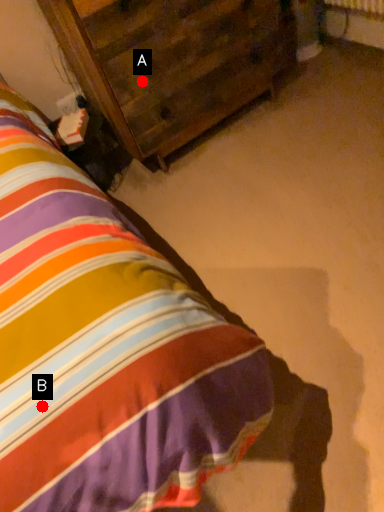
Question: Two points are circled on the image, labeled by A and B beside each circle. Which point appears closest to the camera in this image?

Choices:
 (A) A is closer
 (B) B is closer

Answer: (B)